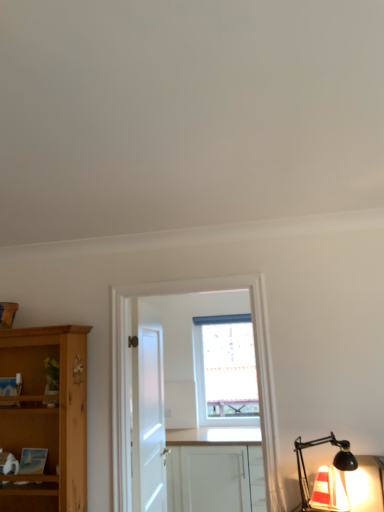
Question: Visually, is white matte cabinet at center positioned to the left or to the right of white wooden cabinet at center?

Choices:
 (A) right
 (B) left

Answer: (A)

Question: From the image's perspective, is white matte cabinet at center above or below white wooden cabinet at center?

Choices:
 (A) below
 (B) above

Answer: (A)

Question: Which object is positioned farthest from the white matte door at center?

Choices:
 (A) translucent glass lamp at lower right
 (B) white wooden cabinet at center
 (C) transparent glass window at center
 (D) white matte cabinet at center

Answer: (C)

Question: Which of these objects is positioned farthest from the translucent glass lamp at lower right?

Choices:
 (A) white matte cabinet at center
 (B) white matte door at center
 (C) white wooden cabinet at center
 (D) transparent glass window at center

Answer: (D)